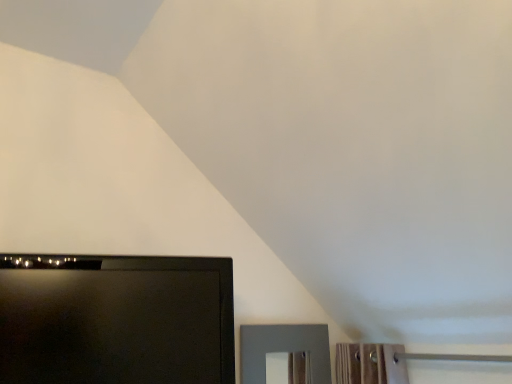
What do you see at coordinates (116, 320) in the screenshot? I see `black glossy monitor at bottom left` at bounding box center [116, 320].

Identify the location of black glossy monitor at bottom left. (116, 320).

Locate an element on the screen. The height and width of the screenshot is (384, 512). black glossy monitor at bottom left is located at coordinates (116, 320).